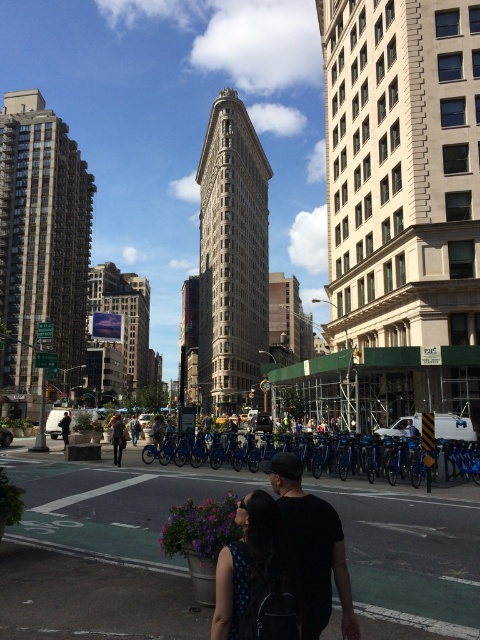
You are a photographer standing at the center of the street. You want to take a photo that includes both the black matte shirt at center and the dark brown leather jacket at center. Given that your camera has a maximum zoom range of 100 meters, will you be able to capture both subjects in a single frame without moving?

The black matte shirt at center and dark brown leather jacket at center are 28.61 meters apart from each other. Since the camera can zoom up to 100 meters, which is greater than the distance between them, you can capture both subjects in a single frame without moving.

You are a photographer standing at the center of the scene. You want to take a photo of the black fabric backpack at center so that it appears centered in your viewfinder. Which direction should you move to align the backpack with the center of your camera frame?

Since the black fabric backpack at center is already at the center of the scene, you don not need to move. It is already positioned at point [254,573], which corresponds to the center of the frame.

You are a fashion designer observing the two individuals in the scene. You need to determine which clothing item would require more fabric to make between the black matte shirt at center and the dark brown leather jacket at center. Which one would need more fabric?

The dark brown leather jacket at center requires more fabric because its width is greater than the black matte shirt at center.